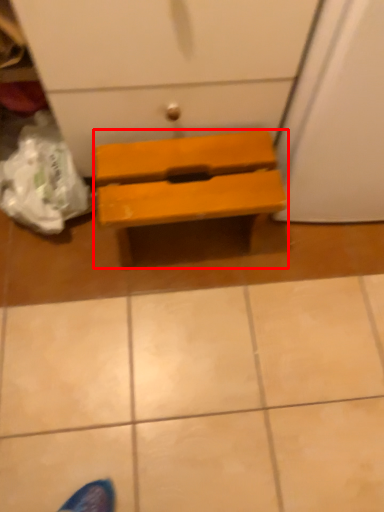
Question: From the image's perspective, where is furniture (annotated by the red box) located relative to tile?

Choices:
 (A) below
 (B) above

Answer: (B)